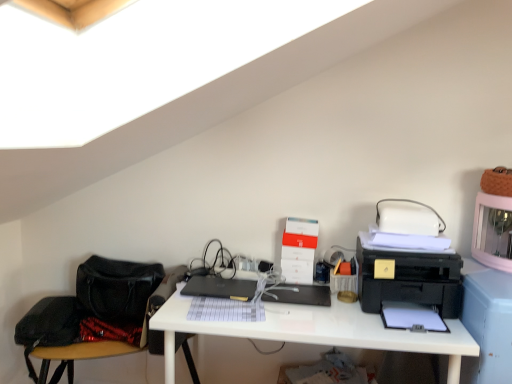
The height and width of the screenshot is (384, 512). Identify the location of free spot above black plastic register at center (from a real-world perspective). (298, 292).